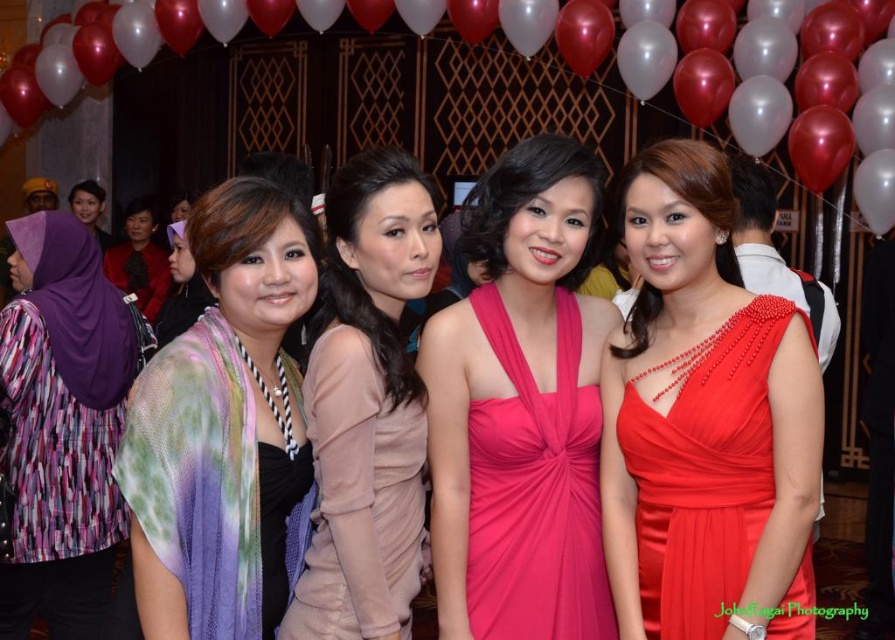
Question: Does matte beige dress at center appear on the right side of matte black hijab at upper left?

Choices:
 (A) yes
 (B) no

Answer: (A)

Question: Is red glossy balloon at upper center positioned behind matte black hijab at upper left?

Choices:
 (A) yes
 (B) no

Answer: (B)

Question: Which is farther from the pastel tie-dye scarf at center?

Choices:
 (A) fuchsia satin dress at center
 (B) shiny red dress at right
 (C) red glossy balloon at upper center

Answer: (C)

Question: Which point appears closest to the camera in this image?

Choices:
 (A) (31, 492)
 (B) (785, 22)

Answer: (A)

Question: Is printed fabric hijab at left to the left of matte black dress at center from the viewer's perspective?

Choices:
 (A) no
 (B) yes

Answer: (A)

Question: Which point is farther from the camera taking this photo?

Choices:
 (A) (30, 518)
 (B) (86, 209)

Answer: (B)